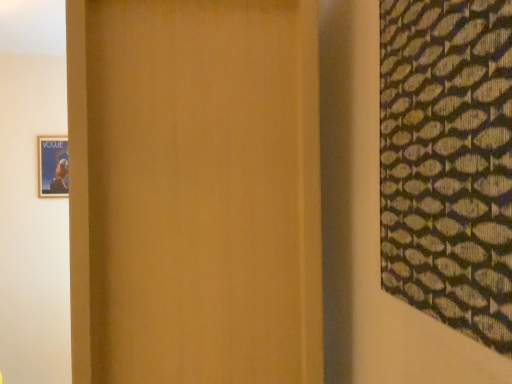
The image size is (512, 384). What do you see at coordinates (194, 191) in the screenshot?
I see `matte wood door at center` at bounding box center [194, 191].

Where is `matte wood door at center`? matte wood door at center is located at coordinates (194, 191).

This screenshot has height=384, width=512. What are the coordinates of `matte wood door at center` in the screenshot? It's located at (194, 191).